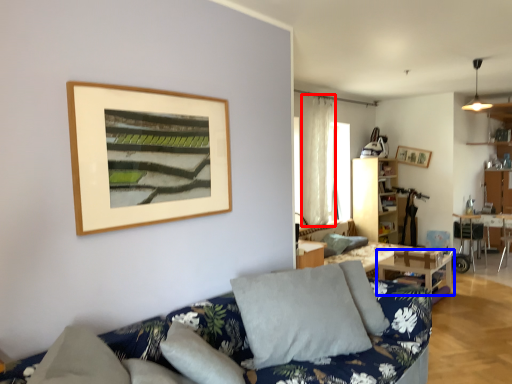
Question: Which object is further to the camera taking this photo, curtain (highlighted by a red box) or table (highlighted by a blue box)?

Choices:
 (A) curtain
 (B) table

Answer: (A)